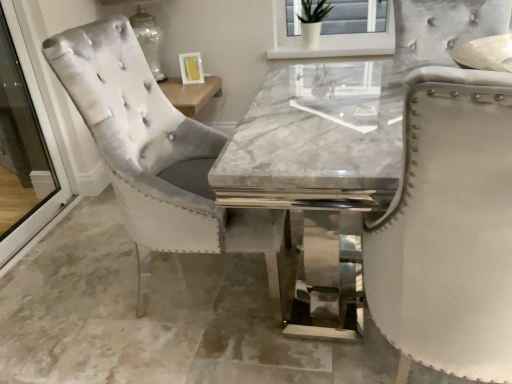
The height and width of the screenshot is (384, 512). Identify the location of free spot below clear glass screen door at left (from a real-world perspective). pyautogui.click(x=37, y=238).